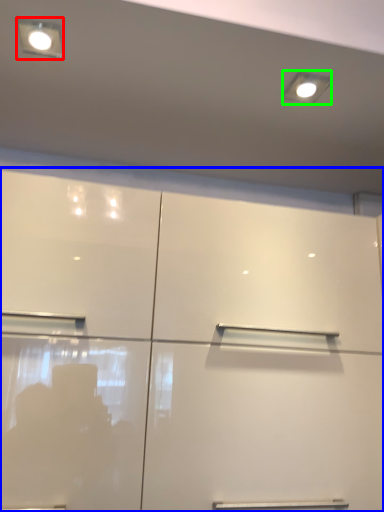
Question: Which is farther away from light fixture (highlighted by a red box)? cupboard (highlighted by a blue box) or lighting (highlighted by a green box)?

Choices:
 (A) cupboard
 (B) lighting

Answer: (A)